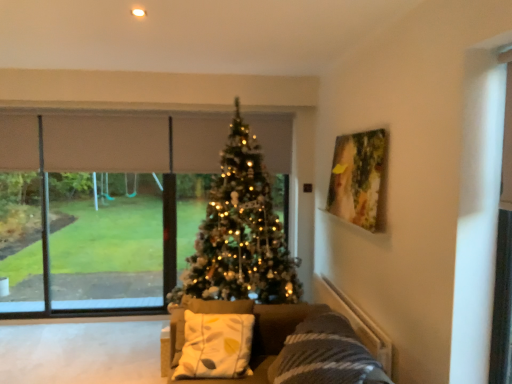
Question: Does point (370, 225) appear closer or farther from the camera than point (509, 91)?

Choices:
 (A) closer
 (B) farther

Answer: (B)

Question: In the image, is wooden painting at upper right positioned in front of or behind transparent glass screen door at right?

Choices:
 (A) behind
 (B) front

Answer: (A)

Question: Which object is the farthest from the white fabric pillow at center?

Choices:
 (A) transparent glass screen door at right
 (B) velvet grey couch at center
 (C) transparent glass window at center
 (D) iridescent gold christmas tree at center
 (E) wooden painting at upper right

Answer: (C)

Question: Which is nearer to the velvet grey couch at center?

Choices:
 (A) transparent glass window at center
 (B) wooden painting at upper right
 (C) transparent glass screen door at right
 (D) white fabric pillow at center
 (E) iridescent gold christmas tree at center

Answer: (D)